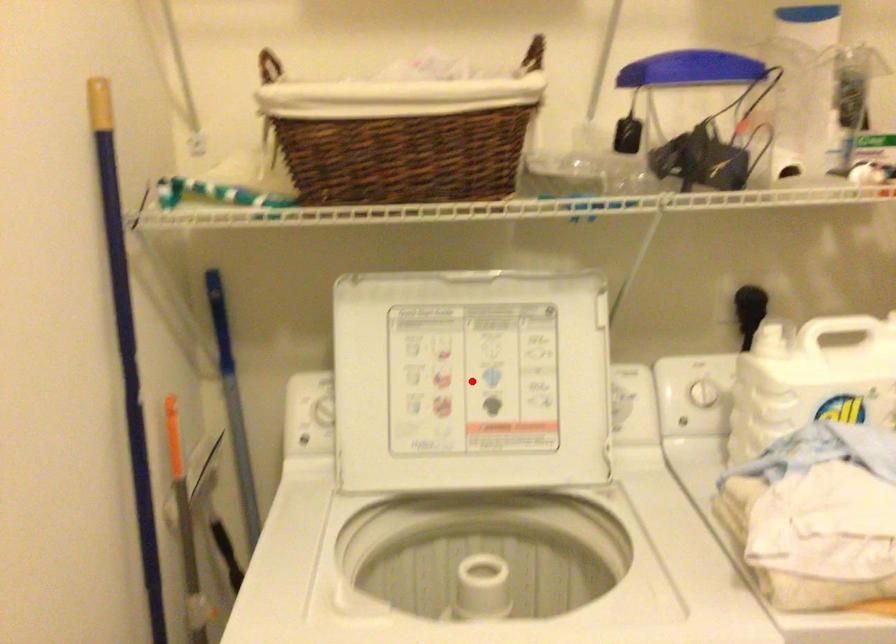
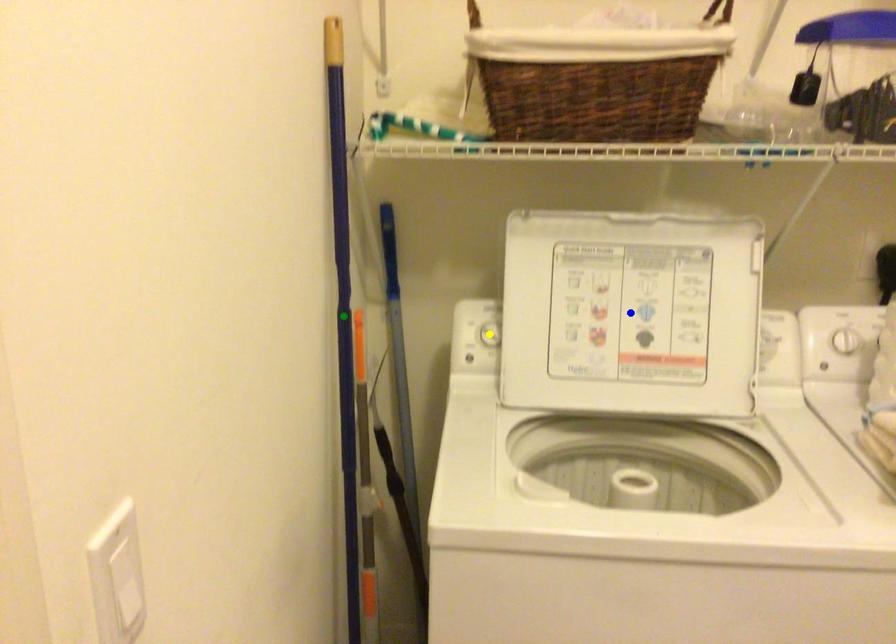
Question: I am providing you with two images of the same scene from different viewpoints. A red point is marked on the first image. You are given multiple points on the second image. Which spot in image 2 lines up with the point in image 1?

Choices:
 (A) green point
 (B) yellow point
 (C) blue point

Answer: (C)